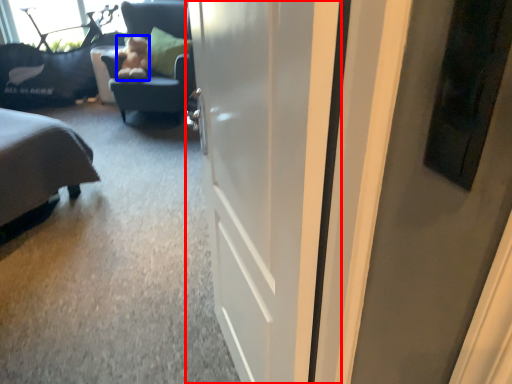
Question: Which of the following is the closest to the observer, door (highlighted by a red box) or teddy (highlighted by a blue box)?

Choices:
 (A) door
 (B) teddy

Answer: (A)